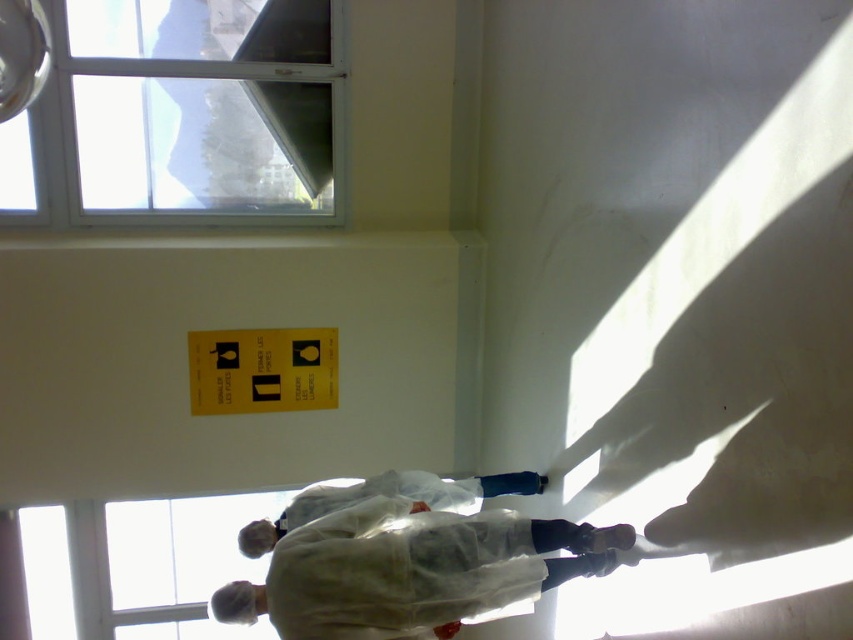
Who is lower down, transparent glass window at upper left or white matte lab coat at center?

white matte lab coat at center is lower down.

Who is positioned more to the right, transparent glass window at upper left or white matte lab coat at center?

From the viewer's perspective, white matte lab coat at center appears more on the right side.

At what (x,y) coordinates should I click in order to perform the action: click on transparent glass window at upper left. Please return your answer as a coordinate pair (x, y). Looking at the image, I should click on (171, 112).